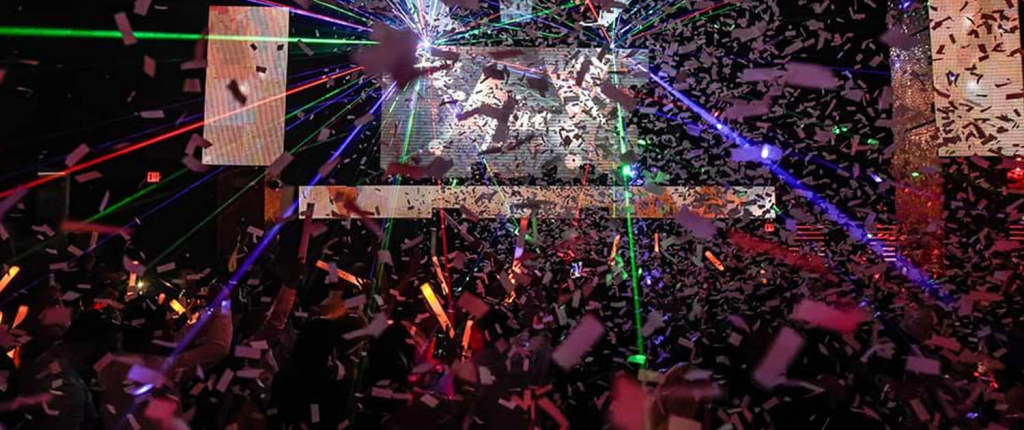
The width and height of the screenshot is (1024, 430). In order to click on green light in this screenshot , I will do `click(383, 242)`.